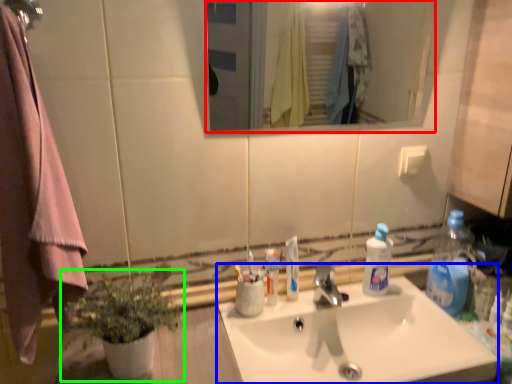
Question: Which object is positioned farthest from mirror (highlighted by a red box)? Select from sink (highlighted by a blue box) and houseplant (highlighted by a green box).

Choices:
 (A) sink
 (B) houseplant

Answer: (B)